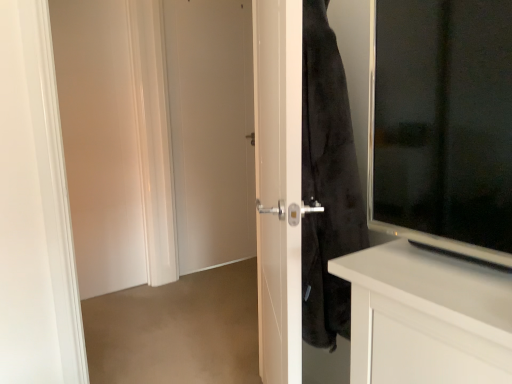
Question: Considering the positions of white matte door at center and white matte door at left, which ranks as the first screen door in left-to-right order, in the image, is white matte door at center wider or thinner than white matte door at left, which ranks as the first screen door in left-to-right order,?

Choices:
 (A) thin
 (B) wide

Answer: (B)

Question: From a real-world perspective, is white matte door at center positioned above or below white matte door at left, the 2th screen door when ordered from front to back?

Choices:
 (A) above
 (B) below

Answer: (A)

Question: Which is nearer to the white glossy door at center, positioned as the first screen door in front-to-back order?

Choices:
 (A) white matte door at center
 (B) white matte door at left, the first screen door in the back-to-front sequence

Answer: (A)

Question: Estimate the real-world distances between objects in this image. Which object is farther from the white glossy door at center, arranged as the first screen door when viewed from the right?

Choices:
 (A) white matte door at center
 (B) white matte door at left, the 2th screen door when ordered from front to back

Answer: (B)